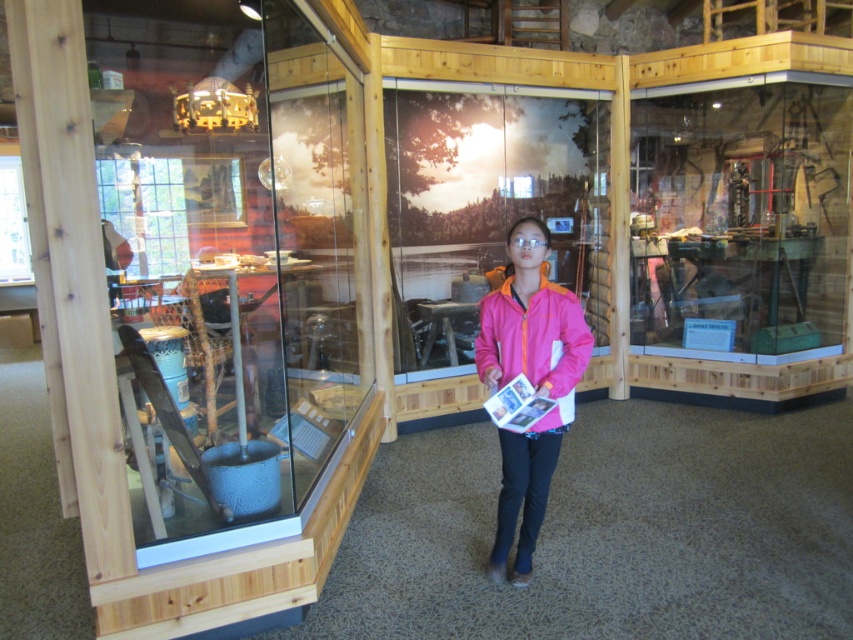
Which is behind, point (541, 502) or point (561, 308)?

The point (541, 502) is behind.

How much distance is there between pink matte jacket at center and pink fleece jacket at center?

pink matte jacket at center and pink fleece jacket at center are 3.45 inches apart from each other.

Identify the location of pink matte jacket at center. The width and height of the screenshot is (853, 640). (531, 385).